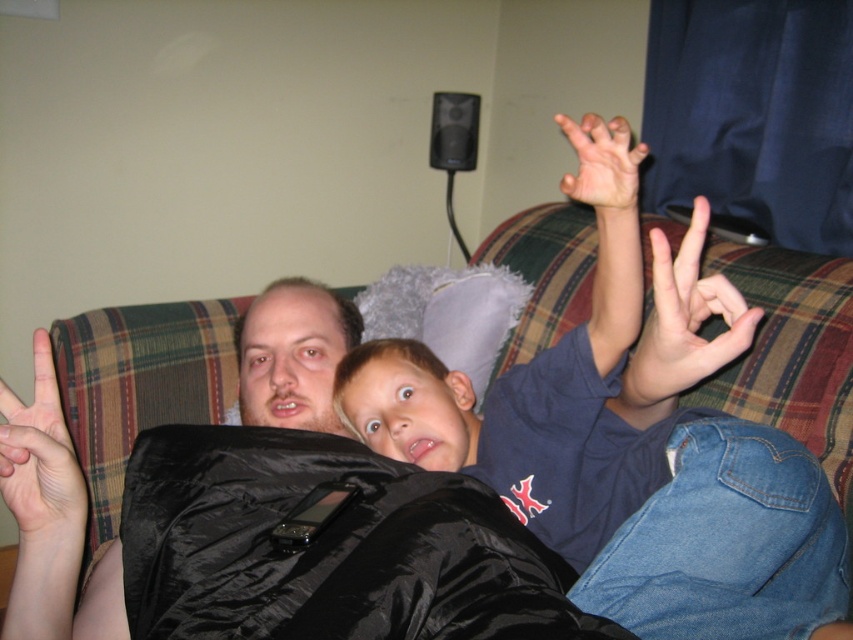
You are taking a photo of the blue cotton shirt at upper right and the white matte hand at upper right. Which object should you zoom in on to make them appear the same size in the photo?

The blue cotton shirt at upper right is bigger than the white matte hand at upper right, so you should zoom in on the white matte hand at upper right to make them appear the same size in the photo.

You are standing in front of the couch and want to place a small gift on the blue cotton shirt at upper right. According to the coordinates given, where should you aim to place the gift?

You should aim for point (630, 452) to place the small gift on the blue cotton shirt at upper right.